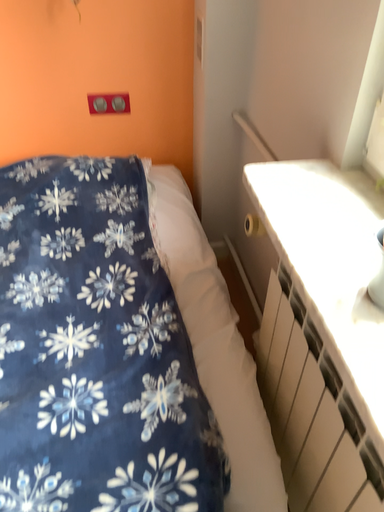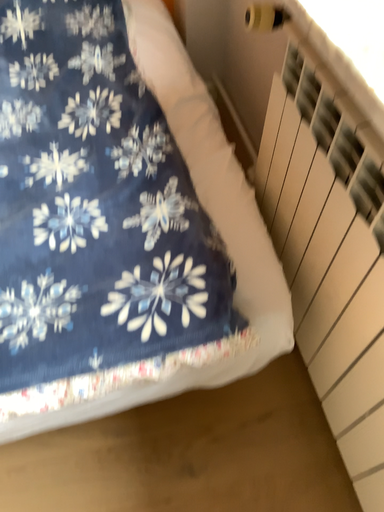
Question: How did the camera likely rotate when shooting the video?

Choices:
 (A) rotated upward
 (B) rotated downward

Answer: (B)